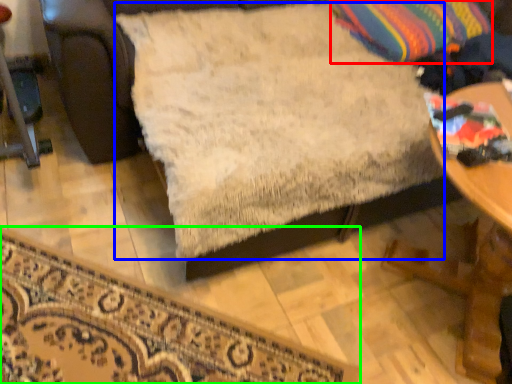
Question: Based on their relative distances, which object is nearer to throw pillow (highlighted by a red box)? Choose from sheet (highlighted by a blue box) and furniture (highlighted by a green box).

Choices:
 (A) sheet
 (B) furniture

Answer: (A)